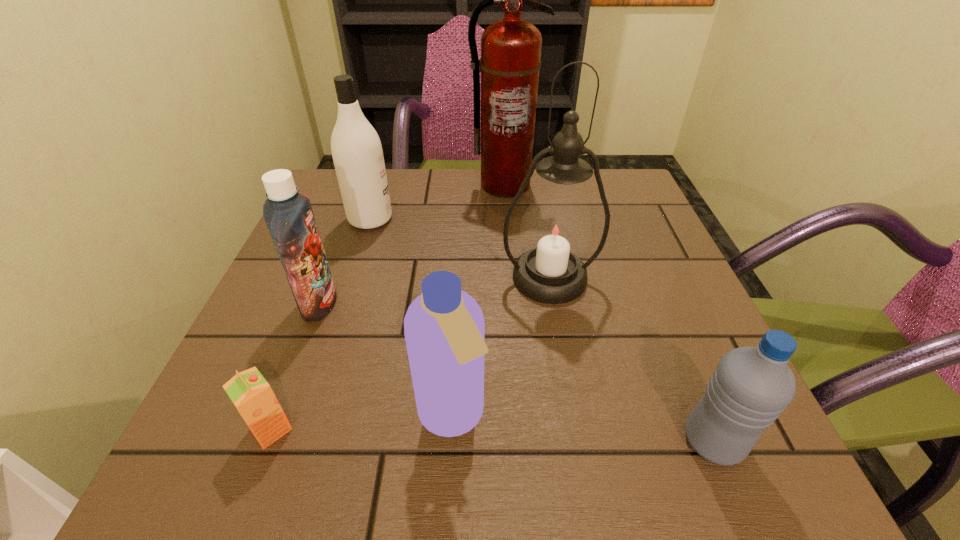
At what (x,y) coordinates should I click in order to perform the action: click on vacant point at the near right corner. Please return your answer as a coordinate pair (x, y). The image size is (960, 540). Looking at the image, I should click on (762, 449).

Identify the location of vacant point located between the tallest shampoo and the farthest object. (438, 202).

This screenshot has height=540, width=960. What are the coordinates of `empty space between the shortest object and the second nearest shampoo` in the screenshot? It's located at (295, 366).

What are the coordinates of `vacant area that lies between the fifth shortest object and the fire extinguisher` in the screenshot? It's located at (438, 202).

The image size is (960, 540). Find the location of `vacant region between the shortest object and the farthest object`. vacant region between the shortest object and the farthest object is located at coordinates (388, 307).

You are a GUI agent. You are given a task and a screenshot of the screen. Output one action in this format:
    pyautogui.click(x=<x>, y=<y>)
    Task: Click on the free space that is in between the oil lamp and the sixth tallest object
    The width and height of the screenshot is (960, 540).
    Given the screenshot: What is the action you would take?
    pyautogui.click(x=631, y=360)

I want to click on vacant space that is in between the rightmost shampoo and the shortest object, so click(362, 423).

In order to click on vacant point located between the rightmost shampoo and the oil lamp in this screenshot , I will do `click(500, 347)`.

Locate which object ranks third in proximity to the farthest shampoo. Please provide its 2D coordinates. Your answer should be formatted as a tuple, i.e. [(x, y)], where the tuple contains the x and y coordinates of a point satisfying the conditions above.

[(556, 230)]

At what (x,y) coordinates should I click in order to perform the action: click on object that is the fourth closest to the farthest shampoo. Please return your answer as a coordinate pair (x, y). Image resolution: width=960 pixels, height=540 pixels. Looking at the image, I should click on (444, 328).